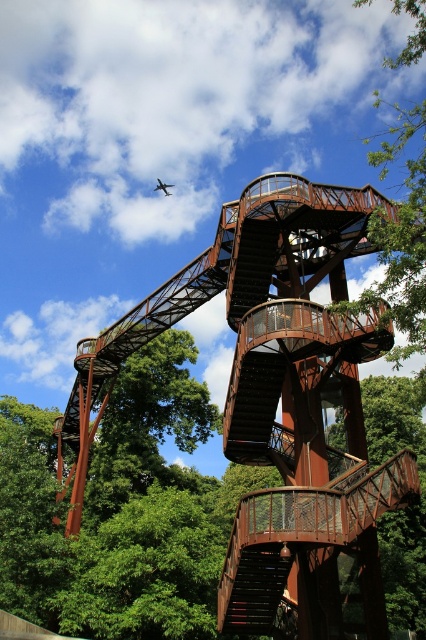
You are standing at the base of the spiral staircase and looking upwards. There are two points marked on the structure. The first point is at coordinates point (247,298) and the second is at point (158,182). Which of these points appears closer to you when viewed from your current position?

Point (247,298) is closer to the camera than point (158,182), so the first point appears closer to you.

You are standing on the ground floor of the spiral staircase and looking upwards. Which object is higher up in the image, the green leafy tree at upper right or the rusty metal staircase at center?

The green leafy tree at upper right is located above the rusty metal staircase at center, so it is higher up in the image.

You are standing at the base of the spiral staircase and want to take a photo of the structure. You notice two points on the staircase labeled as point (x=408, y=243) and point (x=169, y=184). Which point will appear larger in your photo?

Point (x=408, y=243) is closer to the camera than point (x=169, y=184), so it will appear larger in the photo.